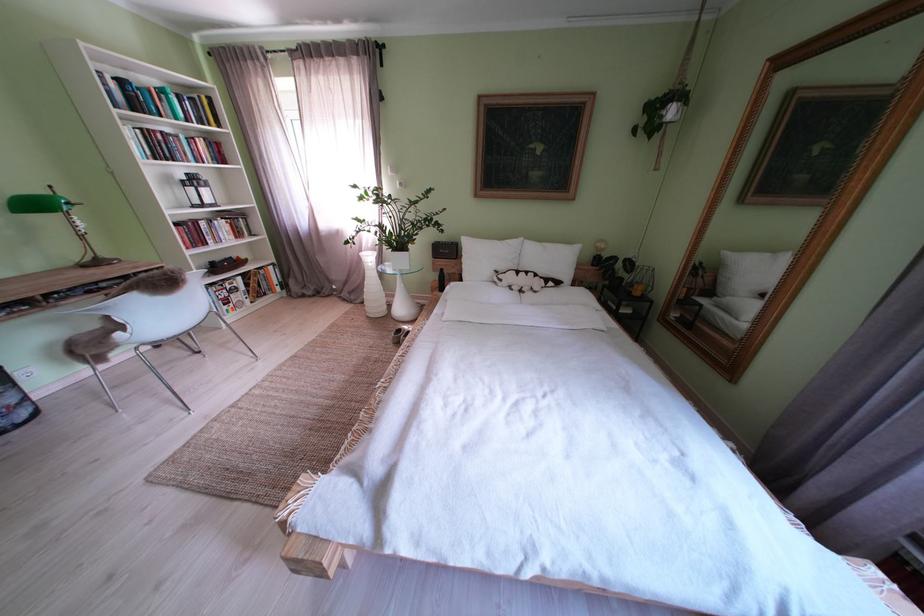
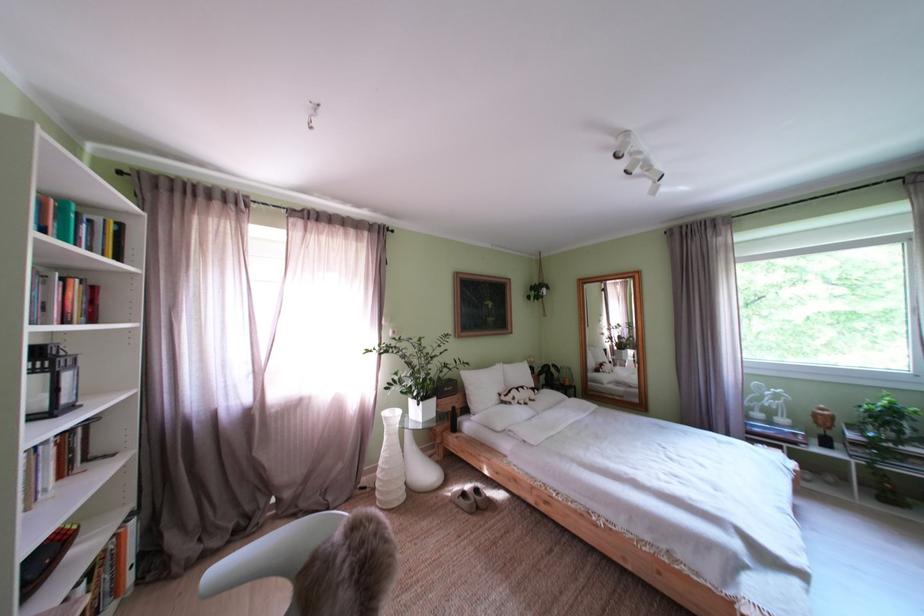
Locate, in the second image, the point that corresponds to point 410,336 in the first image.

(475, 500)